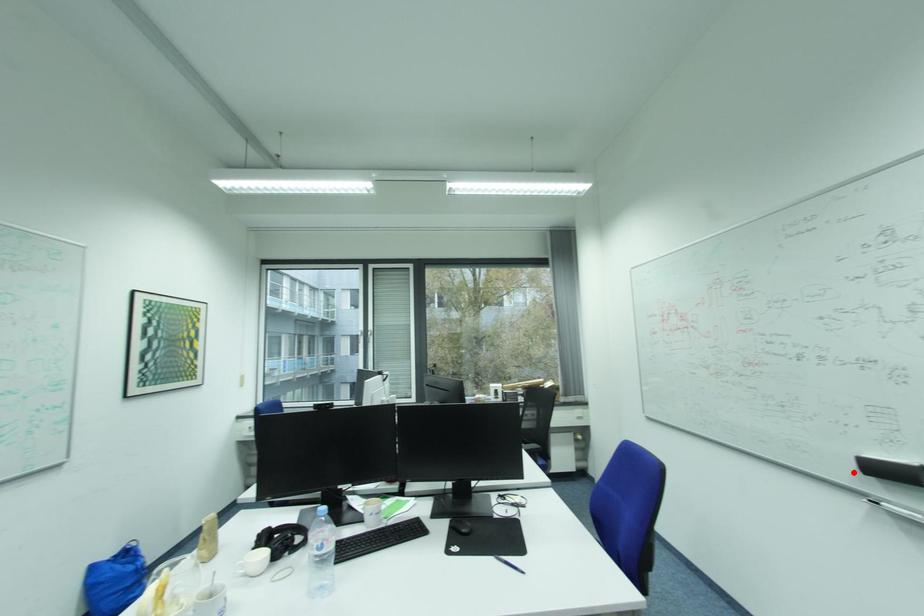
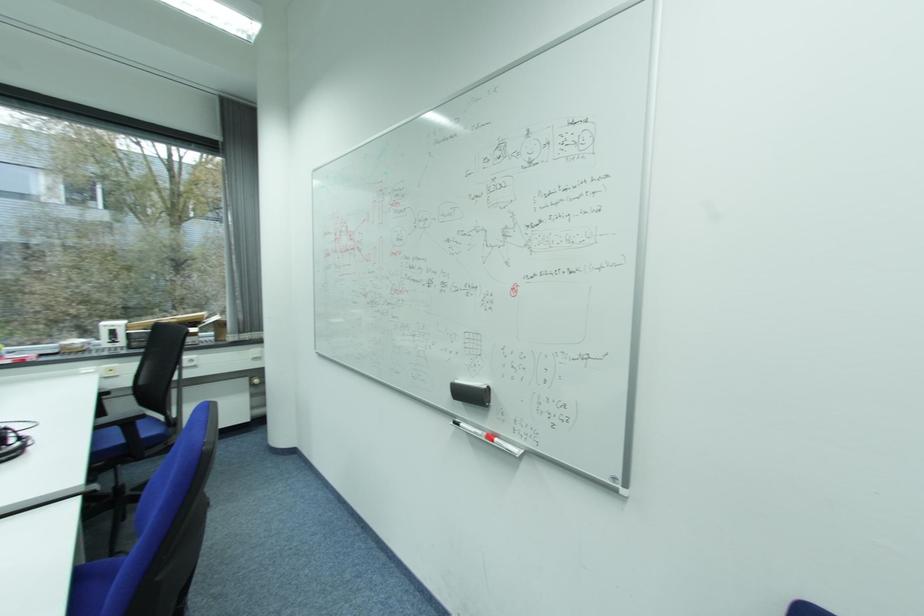
Question: I am providing you with two images of the same scene from different viewpoints. A red point is shown in image1. For the corresponding object point in image2, is it positioned nearer or farther from the camera?

Choices:
 (A) Nearer
 (B) Farther

Answer: (B)